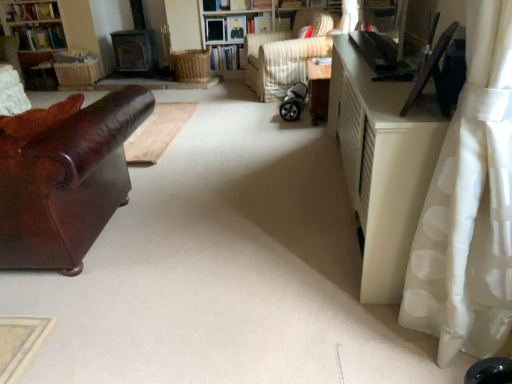
Question: Does striped fabric chair at center have a smaller size compared to white polka dot fabric at right?

Choices:
 (A) yes
 (B) no

Answer: (B)

Question: Is striped fabric chair at center placed right next to white polka dot fabric at right?

Choices:
 (A) yes
 (B) no

Answer: (B)

Question: Can you confirm if striped fabric chair at center is positioned to the right of white polka dot fabric at right?

Choices:
 (A) yes
 (B) no

Answer: (B)

Question: Is striped fabric chair at center taller than white polka dot fabric at right?

Choices:
 (A) no
 (B) yes

Answer: (A)

Question: Is striped fabric chair at center facing towards white polka dot fabric at right?

Choices:
 (A) no
 (B) yes

Answer: (A)

Question: Is striped fabric chair at center to the left of white polka dot fabric at right from the viewer's perspective?

Choices:
 (A) yes
 (B) no

Answer: (A)

Question: From the image's perspective, would you say silver metallic baby carriage at center is shown under white polka dot fabric at right?

Choices:
 (A) yes
 (B) no

Answer: (B)

Question: Is white polka dot fabric at right surrounded by silver metallic baby carriage at center?

Choices:
 (A) yes
 (B) no

Answer: (B)

Question: Can you confirm if silver metallic baby carriage at center is thinner than white polka dot fabric at right?

Choices:
 (A) yes
 (B) no

Answer: (A)

Question: Can you confirm if silver metallic baby carriage at center is shorter than white polka dot fabric at right?

Choices:
 (A) no
 (B) yes

Answer: (B)

Question: Could you tell me if silver metallic baby carriage at center is facing white polka dot fabric at right?

Choices:
 (A) yes
 (B) no

Answer: (B)

Question: Is silver metallic baby carriage at center located outside white polka dot fabric at right?

Choices:
 (A) no
 (B) yes

Answer: (B)

Question: Is shiny brown leather couch at left completely or partially inside wooden bookshelf at center?

Choices:
 (A) no
 (B) yes

Answer: (A)